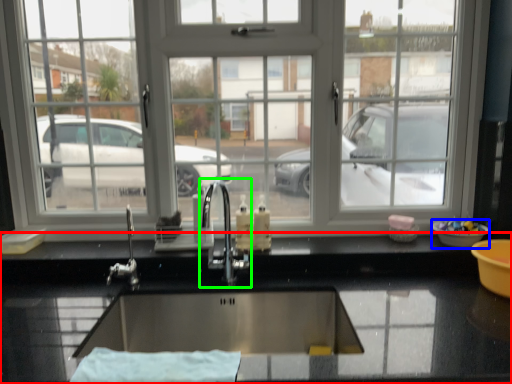
Question: Based on their relative distances, which object is farther from countertop (highlighted by a red box)? Choose from basin (highlighted by a blue box) and tap (highlighted by a green box).

Choices:
 (A) basin
 (B) tap

Answer: (A)